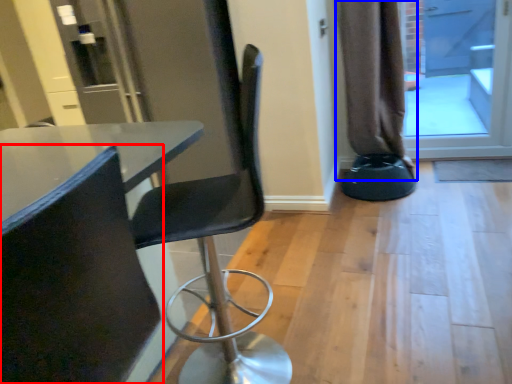
Question: Which object is closer to the camera taking this photo, chair (highlighted by a red box) or curtain (highlighted by a blue box)?

Choices:
 (A) chair
 (B) curtain

Answer: (A)